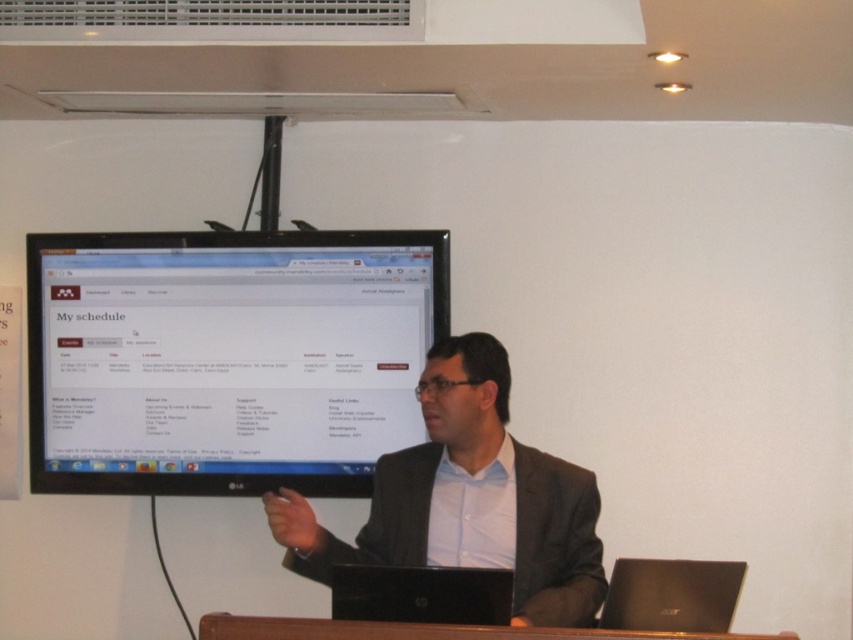
Can you confirm if dark gray suit at center is taller than brown wooden table at lower center?

Yes, dark gray suit at center is taller than brown wooden table at lower center.

Looking at this image, can you confirm if dark gray suit at center is shorter than brown wooden table at lower center?

No, dark gray suit at center is not shorter than brown wooden table at lower center.

Is point (540, 602) closer to viewer compared to point (692, 637)?

No.

I want to click on dark gray suit at center, so click(468, 499).

Can you confirm if black glossy monitor at upper center is taller than brown wooden table at lower center?

Yes, black glossy monitor at upper center is taller than brown wooden table at lower center.

In the scene shown: Which is more to the left, black glossy monitor at upper center or brown wooden table at lower center?

Positioned to the left is black glossy monitor at upper center.

What do you see at coordinates (227, 356) in the screenshot? The width and height of the screenshot is (853, 640). I see `black glossy monitor at upper center` at bounding box center [227, 356].

I want to click on black glossy monitor at upper center, so click(x=227, y=356).

Who is taller, black glossy monitor at upper center or black matte laptop at lower right?

With more height is black glossy monitor at upper center.

Which is in front, point (338, 344) or point (704, 628)?

Point (704, 628) is in front.

The height and width of the screenshot is (640, 853). Identify the location of black glossy monitor at upper center. pos(227,356).

Where is `black glossy monitor at upper center`? The image size is (853, 640). black glossy monitor at upper center is located at coordinates click(x=227, y=356).